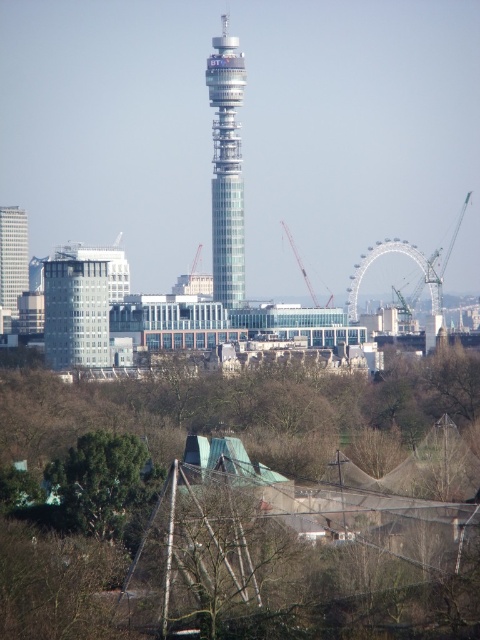
You are a construction worker who needs to move a heavy beam from the ground to the top floor of the glassy gray building at center. The metallic gray crane at center is available. Can the crane reach the building?

The glassy gray building at center is positioned under the metallic gray crane at center, so the crane can reach it.

You are standing at the point with coordinates point [14,244] and want to walk to the point with coordinates point [121,513]. Which direction should you move in relation to the cityscape?

You should move forward towards the point [121,513] because it is in front of point [14,244].

Consider the image. You are a city planner evaluating the skyline. You see the glassy gray building at center and the metallic gray crane at center. Which one has a larger footprint in terms of the area it occupies on the ground?

The glassy gray building at center is bigger than the metallic gray crane at center, so it has a larger footprint on the ground.